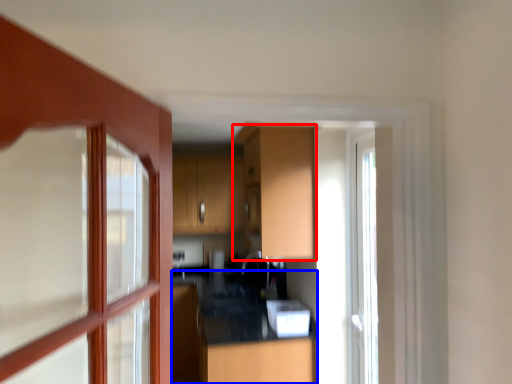
Question: Which object is closer to the camera taking this photo, cabinetry (highlighted by a red box) or counter top (highlighted by a blue box)?

Choices:
 (A) cabinetry
 (B) counter top

Answer: (A)